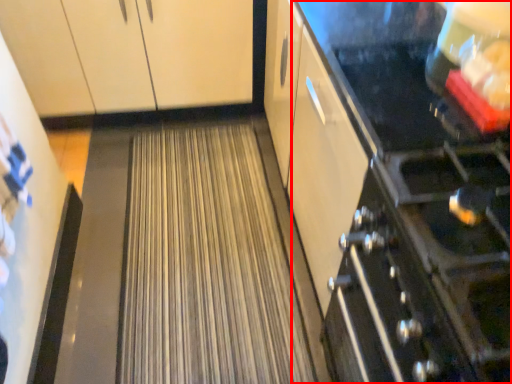
Question: From the image's perspective, what is the correct spatial relationship of appliance (annotated by the red box) in relation to cabinetry?

Choices:
 (A) above
 (B) below

Answer: (B)